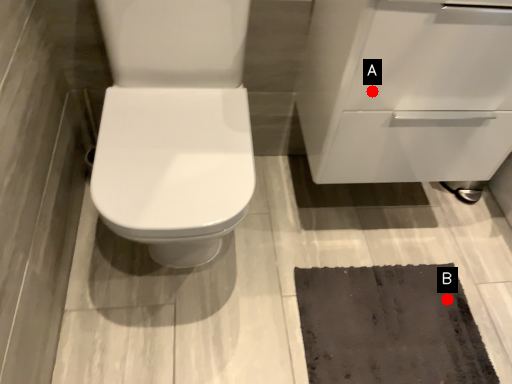
Question: Two points are circled on the image, labeled by A and B beside each circle. Which of the following is the closest to the observer?

Choices:
 (A) A is closer
 (B) B is closer

Answer: (A)